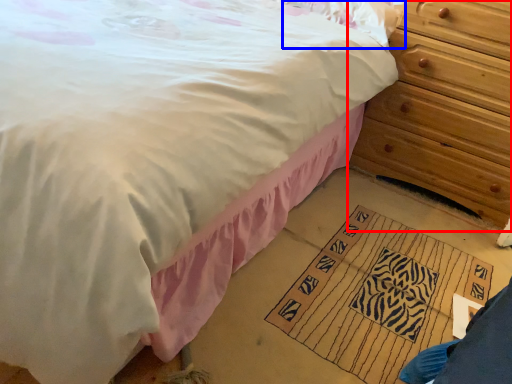
Question: Which point is closer to the camera, chest of drawers (highlighted by a red box) or pillow (highlighted by a blue box)?

Choices:
 (A) chest of drawers
 (B) pillow

Answer: (A)